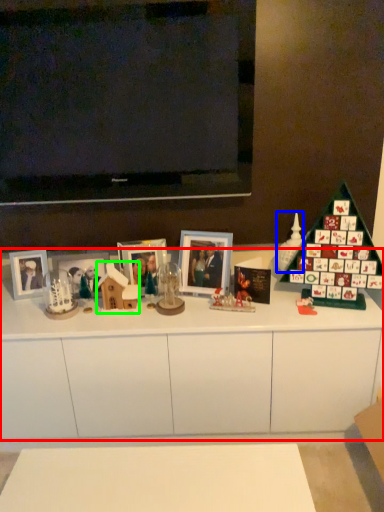
Question: Considering the real-world distances, which object is farthest from cabinetry (highlighted by a red box)? toy (highlighted by a blue box) or toy (highlighted by a green box)?

Choices:
 (A) toy
 (B) toy

Answer: (A)